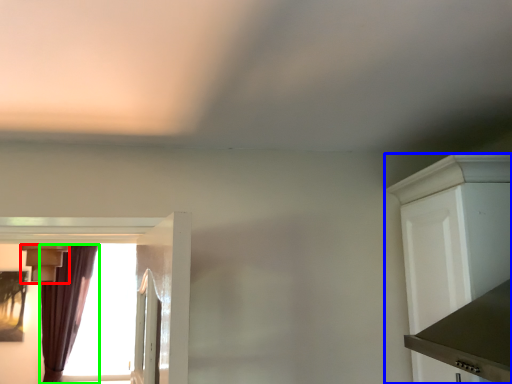
Question: Which object is the farthest from light fixture (highlighted by a red box)? Choose among these: cabinetry (highlighted by a blue box) or curtain (highlighted by a green box).

Choices:
 (A) cabinetry
 (B) curtain

Answer: (A)